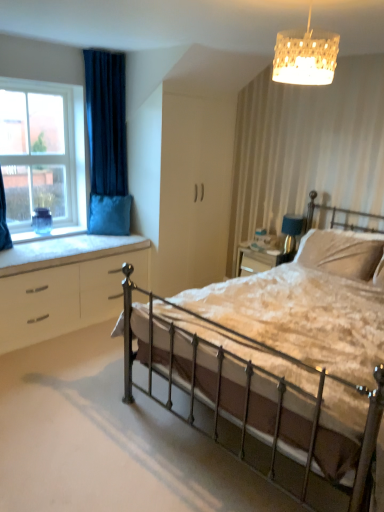
In order to face blue fabric table lamp at right, should I rotate leftwards or rightwards?

Turn right by 13.448 degrees to look at blue fabric table lamp at right.

This screenshot has height=512, width=384. Identify the location of clear glass window at left. (42, 152).

The width and height of the screenshot is (384, 512). What are the coordinates of `dark blue velvet curtain at upper left` in the screenshot? It's located at (107, 143).

At what (x,y) coordinates should I click in order to perform the action: click on velvet beige pillow at center, the first pillow from the front. Please return your answer as a coordinate pair (x, y). Image resolution: width=384 pixels, height=512 pixels. Looking at the image, I should click on (341, 252).

The height and width of the screenshot is (512, 384). I want to click on metallic iron bed at center, so click(280, 359).

Image resolution: width=384 pixels, height=512 pixels. What are the coordinates of `white textured lampshade at upper center` in the screenshot? It's located at (305, 56).

What is the approximate width of velvet blue pillow at window, the first pillow viewed from the left?

It is 12.04 inches.

Locate an element on the screen. The image size is (384, 512). velvet blue pillow at window, placed as the 2th pillow when sorted from front to back is located at coordinates (109, 214).

This screenshot has height=512, width=384. Find the location of `white glossy chest of drawers at lower left`. white glossy chest of drawers at lower left is located at coordinates (65, 286).

I want to click on blue fabric table lamp at right, so click(291, 231).

Is velvet beige pillow at center, placed as the first pillow when sorted from right to left, not close to blue fabric table lamp at right?

They are positioned close to each other.

From a real-world perspective, which object stands above the other?

blue fabric table lamp at right, from a real-world perspective.

Which is in front, velvet beige pillow at center, the 2th pillow when ordered from back to front, or blue fabric table lamp at right?

velvet beige pillow at center, the 2th pillow when ordered from back to front, is closer to the camera.

Could you tell me if velvet beige pillow at center, the 2th pillow when ordered from back to front, is facing blue fabric table lamp at right?

No, velvet beige pillow at center, the 2th pillow when ordered from back to front, is not turned towards blue fabric table lamp at right.

How far apart are white textured lampshade at upper center and clear glass window at left?

They are 8.59 feet apart.

From a real-world perspective, is white textured lampshade at upper center physically located above or below clear glass window at left?

white textured lampshade at upper center is situated higher than clear glass window at left in the real world.

Could you tell me if white textured lampshade at upper center is turned towards clear glass window at left?

No.

Are white textured lampshade at upper center and clear glass window at left making contact?

No, white textured lampshade at upper center is not next to clear glass window at left.

Would you consider dark blue velvet curtain at upper left to be distant from white cushioned window sill at lower left?

They are positioned close to each other.

Is dark blue velvet curtain at upper left taller than white cushioned window sill at lower left?

Correct, dark blue velvet curtain at upper left is much taller as white cushioned window sill at lower left.

Is dark blue velvet curtain at upper left bigger or smaller than white cushioned window sill at lower left?

Considering their sizes, dark blue velvet curtain at upper left takes up more space than white cushioned window sill at lower left.

What's the angular difference between dark blue velvet curtain at upper left and white cushioned window sill at lower left's facing directions?

They differ by 0.214 degrees in their facing directions.

Measure the distance from white glossy chest of drawers at lower left to blue fabric table lamp at right.

The distance of white glossy chest of drawers at lower left from blue fabric table lamp at right is 1.91 meters.

I want to click on table lamp on the right of the white glossy chest of drawers at lower left, so click(291, 231).

From the image's perspective, does white glossy chest of drawers at lower left appear lower than blue fabric table lamp at right?

Correct, white glossy chest of drawers at lower left appears lower than blue fabric table lamp at right in the image.

Does velvet blue pillow at window, the first pillow viewed from the left, lie behind metallic iron bed at center?

Yes, velvet blue pillow at window, the first pillow viewed from the left, is behind metallic iron bed at center.

Is velvet blue pillow at window, which is the 2th pillow in right-to-left order, positioned with its back to metallic iron bed at center?

That's not correct — velvet blue pillow at window, which is the 2th pillow in right-to-left order, is not looking away from metallic iron bed at center.

From the image's perspective, does velvet blue pillow at window, the first pillow in the back-to-front sequence, appear higher than metallic iron bed at center?

Correct, velvet blue pillow at window, the first pillow in the back-to-front sequence, appears higher than metallic iron bed at center in the image.

Starting from the metallic iron bed at center, which pillow is the 2nd one behind? Please provide its 2D coordinates.

[(109, 214)]

Is velvet blue pillow at window, the first pillow in the back-to-front sequence, surrounded by metallic iron bed at center?

No, velvet blue pillow at window, the first pillow in the back-to-front sequence, is not a part of metallic iron bed at center.

Considering the relative positions of metallic iron bed at center and velvet blue pillow at window, the first pillow in the back-to-front sequence, in the image provided, is metallic iron bed at center in front of velvet blue pillow at window, the first pillow in the back-to-front sequence,?

Yes, metallic iron bed at center is closer to the camera.

Is metallic iron bed at center next to velvet blue pillow at window, the first pillow viewed from the left?

No, metallic iron bed at center is not making contact with velvet blue pillow at window, the first pillow viewed from the left.

Considering the relative sizes of metallic iron bed at center and clear glass window at left in the image provided, is metallic iron bed at center taller than clear glass window at left?

In fact, metallic iron bed at center may be shorter than clear glass window at left.

Which is closer to the camera, (352, 402) or (12, 215)?

Point (352, 402)

What's the angular difference between metallic iron bed at center and clear glass window at left's facing directions?

The angular difference between metallic iron bed at center and clear glass window at left is 90 degrees.

Based on the photo, considering the positions of objects metallic iron bed at center and clear glass window at left in the image provided, who is in front, metallic iron bed at center or clear glass window at left?

metallic iron bed at center is closer to the camera.

Image resolution: width=384 pixels, height=512 pixels. I want to click on pillow that is on the right side of blue fabric table lamp at right, so click(x=341, y=252).

The width and height of the screenshot is (384, 512). Identify the location of window that is behind the white textured lampshade at upper center. (42, 152).

Based on their spatial positions, is white cushioned window sill at lower left or velvet blue pillow at window, the first pillow in the back-to-front sequence, closer to white textured lampshade at upper center?

white cushioned window sill at lower left is positioned closer to the anchor white textured lampshade at upper center.

Consider the image. Looking at the image, which one is located closer to velvet blue pillow at window, the first pillow viewed from the left, velvet beige pillow at center, the 2th pillow when ordered from back to front, or clear glass window at left?

clear glass window at left is positioned closer to the anchor velvet blue pillow at window, the first pillow viewed from the left.

Looking at the image, which one is located further to velvet beige pillow at center, placed as the first pillow when sorted from right to left, white cushioned window sill at lower left or white glossy chest of drawers at lower left?

white glossy chest of drawers at lower left is positioned further to the anchor velvet beige pillow at center, placed as the first pillow when sorted from right to left.

Looking at the image, which one is located further to velvet blue pillow at window, the first pillow in the back-to-front sequence, velvet beige pillow at center, placed as the first pillow when sorted from right to left, or dark blue velvet curtain at upper left?

velvet beige pillow at center, placed as the first pillow when sorted from right to left.

Which object lies nearer to the anchor point dark blue velvet curtain at upper left, blue fabric table lamp at right or clear glass window at left?

Based on the image, clear glass window at left appears to be nearer to dark blue velvet curtain at upper left.

Estimate the real-world distances between objects in this image. Which object is further from white glossy chest of drawers at lower left, velvet beige pillow at center, placed as the first pillow when sorted from right to left, or blue fabric table lamp at right?

blue fabric table lamp at right lies further to white glossy chest of drawers at lower left than the other object.

When comparing their distances from metallic iron bed at center, does velvet blue pillow at window, placed as the 2th pillow when sorted from front to back, or velvet beige pillow at center, the first pillow from the front, seem further?

velvet blue pillow at window, placed as the 2th pillow when sorted from front to back.

From the picture: Based on their spatial positions, is velvet blue pillow at window, the first pillow viewed from the left, or white textured lampshade at upper center closer to dark blue velvet curtain at upper left?

velvet blue pillow at window, the first pillow viewed from the left.

Image resolution: width=384 pixels, height=512 pixels. I want to click on chest of drawers between metallic iron bed at center and velvet blue pillow at window, the first pillow viewed from the left, in the front-back direction, so click(65, 286).

You are a GUI agent. You are given a task and a screenshot of the screen. Output one action in this format:
    pyautogui.click(x=<x>, y=<y>)
    Task: Click on the window sill that lies between dark blue velvet curtain at upper left and white glossy chest of drawers at lower left from top to bottom
    The width and height of the screenshot is (384, 512).
    Given the screenshot: What is the action you would take?
    65,251

Locate an element on the screen. The image size is (384, 512). table lamp situated between white glossy chest of drawers at lower left and velvet beige pillow at center, acting as the second pillow starting from the left, from left to right is located at coordinates (291, 231).

Find the location of `window sill between white textured lampshade at upper center and velvet blue pillow at window, the first pillow viewed from the left, in the front-back direction`. window sill between white textured lampshade at upper center and velvet blue pillow at window, the first pillow viewed from the left, in the front-back direction is located at coordinates (65, 251).